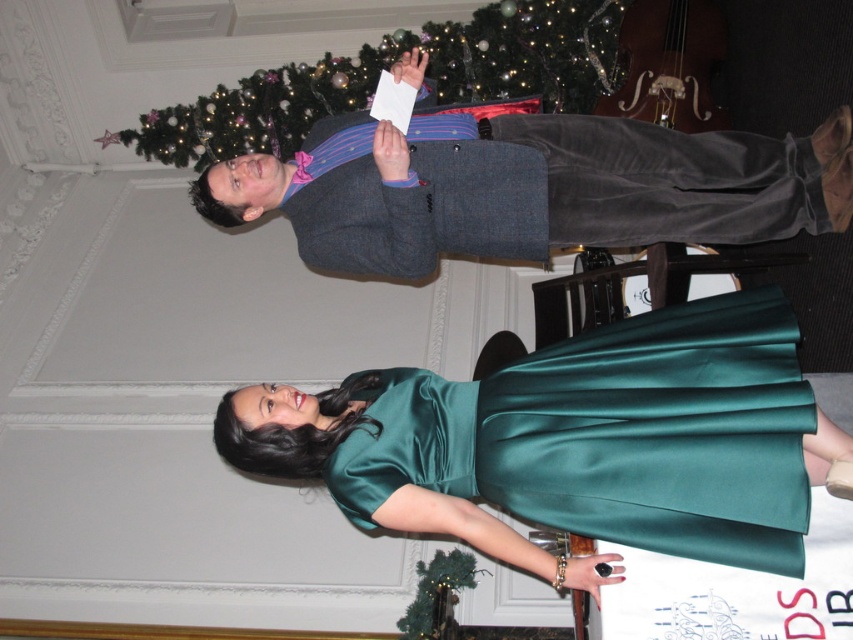
Question: Is green textured christmas tree at upper center smaller than green matte christmas tree at center?

Choices:
 (A) yes
 (B) no

Answer: (B)

Question: Which object is farther from the camera taking this photo?

Choices:
 (A) matte gray suit at center
 (B) emerald satin dress at center

Answer: (A)

Question: Based on their relative distances, which object is nearer to the emerald satin dress at center?

Choices:
 (A) green matte christmas tree at center
 (B) matte gray suit at center

Answer: (B)

Question: Where is green textured christmas tree at upper center located in relation to green matte christmas tree at center in the image?

Choices:
 (A) above
 (B) below

Answer: (A)

Question: Among these points, which one is nearest to the camera?

Choices:
 (A) (320, 252)
 (B) (610, 26)

Answer: (A)

Question: Is emerald satin dress at center thinner than matte gray suit at center?

Choices:
 (A) yes
 (B) no

Answer: (A)